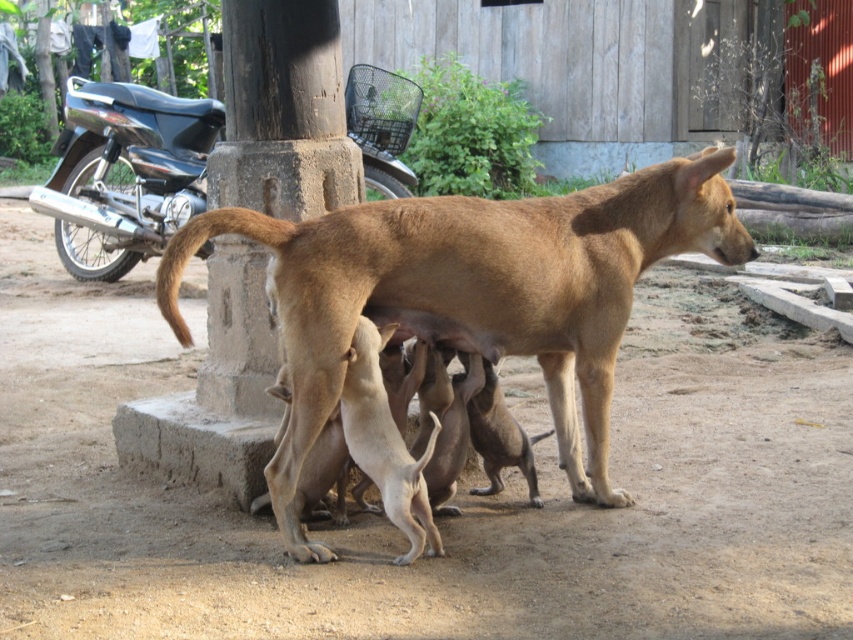
You are standing at the point marked by the coordinate point at (473, 292). What is the nearest object to you in the scene?

The nearest object to you at point (473, 292) is the brown smooth dog at center.

You are a delivery person who needs to load a package onto the black glossy motorcycle at upper left. The package requires a space larger than the brown smooth dog at center. Can the motorcycle handle the package?

The brown smooth dog at center is larger in size than the black glossy motorcycle at upper left, so the motorcycle may not have enough space to accommodate the package that requires a larger space than the dog.

Consider the image. What are the coordinates of the brown smooth dog at center?

The brown smooth dog at center is located at point (473, 292).